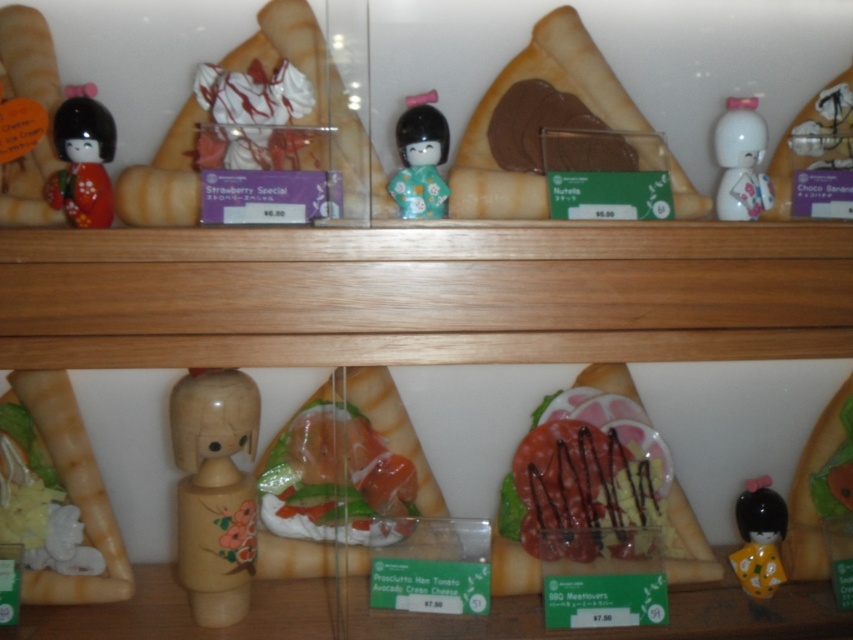
Question: Which of these objects is positioned closest to the matte black figurine at upper left?

Choices:
 (A) wooden doll at center
 (B) translucent plastic sandwich at center

Answer: (A)

Question: Does matte black figurine at upper left have a lesser width compared to matte black doll at lower right?

Choices:
 (A) yes
 (B) no

Answer: (B)

Question: Is shiny chocolate sandwich at center below white glossy figurine at upper right?

Choices:
 (A) no
 (B) yes

Answer: (B)

Question: Which of the following is the farthest from the observer?

Choices:
 (A) wooden doll at center
 (B) matte black doll at lower right
 (C) shiny chocolate sandwich at center

Answer: (B)

Question: Which of the following is the closest to the observer?

Choices:
 (A) (428, 93)
 (B) (80, 189)
 (C) (346, 476)
 (D) (194, 461)

Answer: (B)

Question: Considering the relative positions of shiny chocolate sandwich at center and matte black doll at lower right in the image provided, where is shiny chocolate sandwich at center located with respect to matte black doll at lower right?

Choices:
 (A) below
 (B) above

Answer: (B)